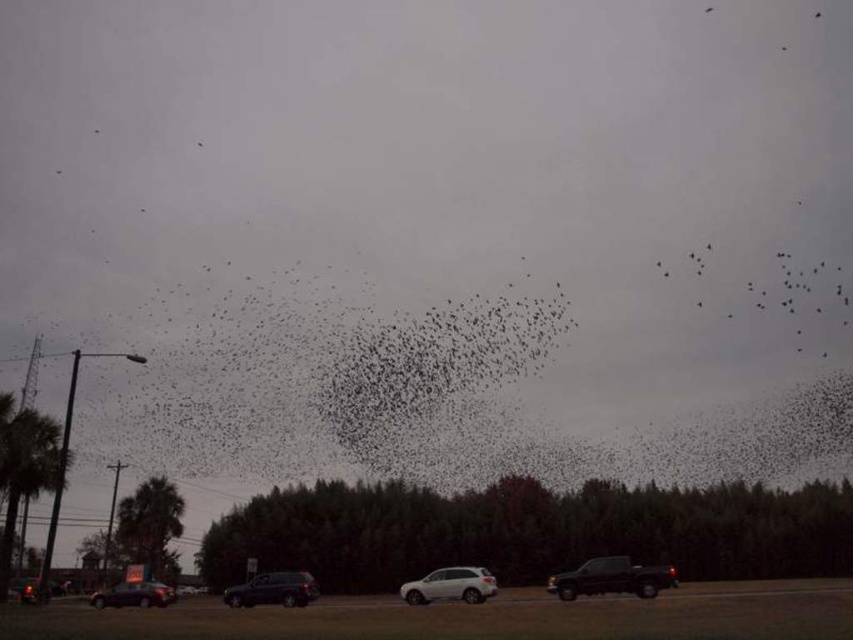
You are a pedestrian standing at the edge of the road and see the shiny black suv at center and the shiny black sedan at lower left. Which vehicle is closer to the right side of the road?

The shiny black suv at center is positioned on the right side of the shiny black sedan at lower left, so the shiny black suv at center is closer to the right side of the road.

You are a photographer trying to capture a photo of the black matte truck at lower right and the white matte suv at center. Which vehicle should you focus on first if you want to include both in your frame without moving the camera?

The black matte truck at lower right is bigger than the white matte suv at center, so you should focus on the black matte truck at lower right first to ensure it fits properly in the frame.

You are a pedestrian standing on the side of the road and want to cross to the other side. You see the black matte truck at lower right and the shiny black sedan at lower left. Which vehicle is closer to you?

The black matte truck at lower right is closer to the viewer than the shiny black sedan at lower left.